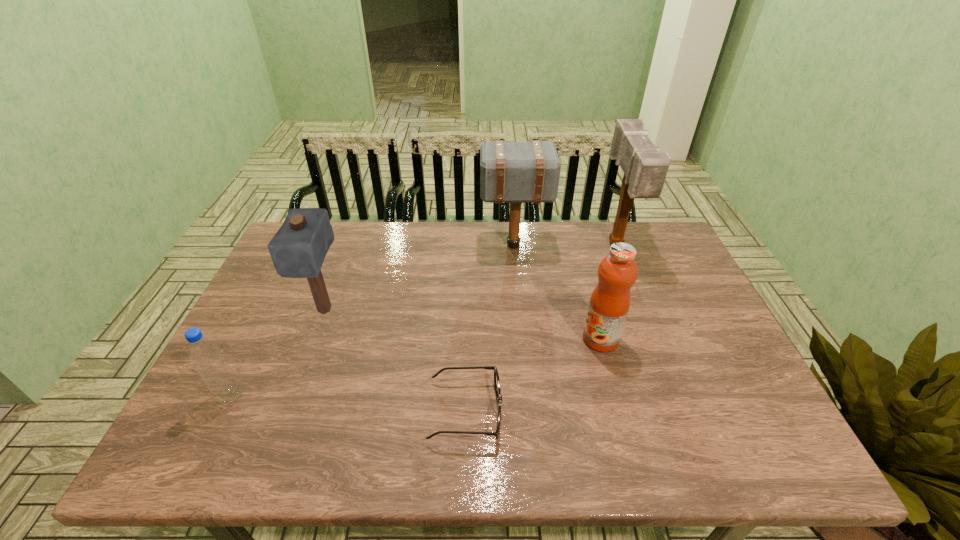
Image resolution: width=960 pixels, height=540 pixels. What are the coordinates of `vacant point located between the rightmost mallet and the water bottle` in the screenshot? It's located at (423, 321).

This screenshot has width=960, height=540. In order to click on vacant region between the fifth object from right to left and the fifth tallest object in this screenshot , I will do `click(277, 353)`.

Where is `vacant point located between the fruit juice and the nearest mallet`? vacant point located between the fruit juice and the nearest mallet is located at coordinates pyautogui.click(x=463, y=325).

Locate an element on the screen. unoccupied area between the shortest object and the second object from right to left is located at coordinates (533, 375).

You are a GUI agent. You are given a task and a screenshot of the screen. Output one action in this format:
    pyautogui.click(x=<x>, y=<y>)
    Task: Click on the vacant area that lies between the leftmost mallet and the second mallet from left to right
    This screenshot has height=540, width=960.
    Given the screenshot: What is the action you would take?
    pyautogui.click(x=420, y=278)

You are a GUI agent. You are given a task and a screenshot of the screen. Output one action in this format:
    pyautogui.click(x=<x>, y=<y>)
    Task: Click on the vacant space that's between the second shortest object and the rightmost mallet
    
    Given the screenshot: What is the action you would take?
    pyautogui.click(x=423, y=321)

Where is `vacant space that is in between the shortest object and the fruit juice`? vacant space that is in between the shortest object and the fruit juice is located at coordinates (533, 375).

Where is `unoccupied area between the rightmost object and the nearest mallet`? The image size is (960, 540). unoccupied area between the rightmost object and the nearest mallet is located at coordinates (470, 278).

The image size is (960, 540). Identify the location of object identified as the fifth closest to the shortest object. (645, 169).

The image size is (960, 540). In order to click on the fourth closest object to the rightmost mallet in this screenshot , I will do `click(298, 249)`.